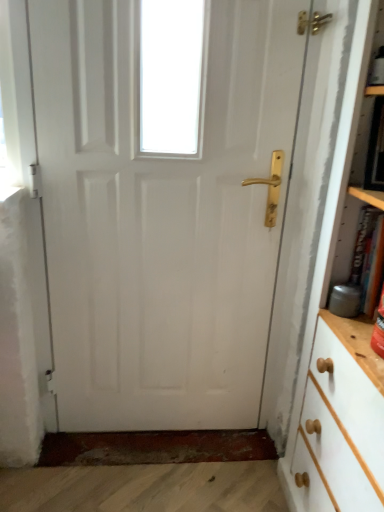
Question: Can you confirm if hardcover book at right is smaller than white glossy door at center?

Choices:
 (A) no
 (B) yes

Answer: (B)

Question: Is hardcover book at right positioned with its back to white glossy door at center?

Choices:
 (A) no
 (B) yes

Answer: (A)

Question: Could you tell me if hardcover book at right is facing white glossy door at center?

Choices:
 (A) no
 (B) yes

Answer: (A)

Question: Considering the relative positions of hardcover book at right and white glossy door at center in the image provided, is hardcover book at right behind white glossy door at center?

Choices:
 (A) no
 (B) yes

Answer: (A)

Question: Is hardcover book at right far from white glossy door at center?

Choices:
 (A) no
 (B) yes

Answer: (A)

Question: Does hardcover book at right appear on the left side of white glossy door at center?

Choices:
 (A) yes
 (B) no

Answer: (B)

Question: Can you see white glossy door at center touching hardcover book at right?

Choices:
 (A) yes
 (B) no

Answer: (B)

Question: Does white glossy door at center come behind hardcover book at right?

Choices:
 (A) no
 (B) yes

Answer: (B)

Question: Are white glossy door at center and hardcover book at right located far from each other?

Choices:
 (A) no
 (B) yes

Answer: (A)

Question: Does white glossy door at center appear on the right side of hardcover book at right?

Choices:
 (A) yes
 (B) no

Answer: (B)

Question: Is white glossy door at center positioned with its back to hardcover book at right?

Choices:
 (A) no
 (B) yes

Answer: (A)

Question: Does white glossy door at center have a larger size compared to hardcover book at right?

Choices:
 (A) yes
 (B) no

Answer: (A)

Question: Is white painted wood bookcase at right behind hardcover book at right?

Choices:
 (A) yes
 (B) no

Answer: (B)